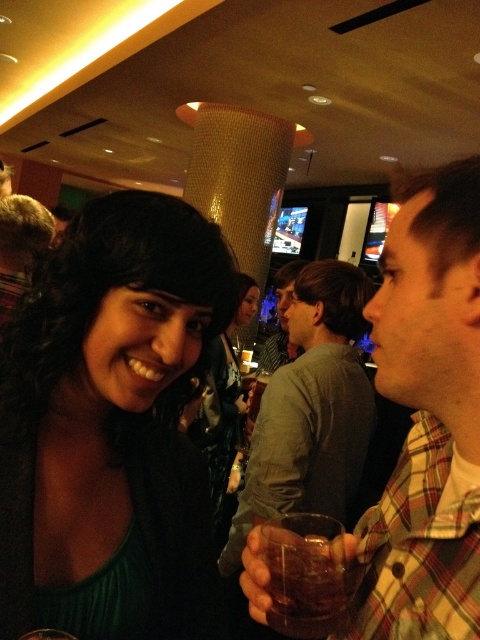
Between green matte dress at center and gray matte shirt at center, which one has more height?

With more height is gray matte shirt at center.

Can you confirm if green matte dress at center is wider than gray matte shirt at center?

No, green matte dress at center is not wider than gray matte shirt at center.

What do you see at coordinates (111, 412) in the screenshot? I see `green matte dress at center` at bounding box center [111, 412].

Where is `green matte dress at center`? This screenshot has width=480, height=640. green matte dress at center is located at coordinates (111, 412).

Who is more forward, (x=227, y=403) or (x=252, y=397)?

Answer: Point (x=252, y=397)

Does matte black hair at center have a smaller size compared to translucent glass at center?

No.

Measure the distance between point (x=229, y=451) and camera.

2.22 meters

Where is `matte black hair at center`? matte black hair at center is located at coordinates (220, 397).

Is plaid fabric shirt at right wider than gray matte shirt at center?

In fact, plaid fabric shirt at right might be narrower than gray matte shirt at center.

Is plaid fabric shirt at right bigger than gray matte shirt at center?

No.

Does point (429, 417) come closer to viewer compared to point (314, 403)?

That is True.

At what (x,y) coordinates should I click in order to perform the action: click on plaid fabric shirt at right. Please return your answer as a coordinate pair (x, y). The image size is (480, 640). Looking at the image, I should click on [x=427, y=419].